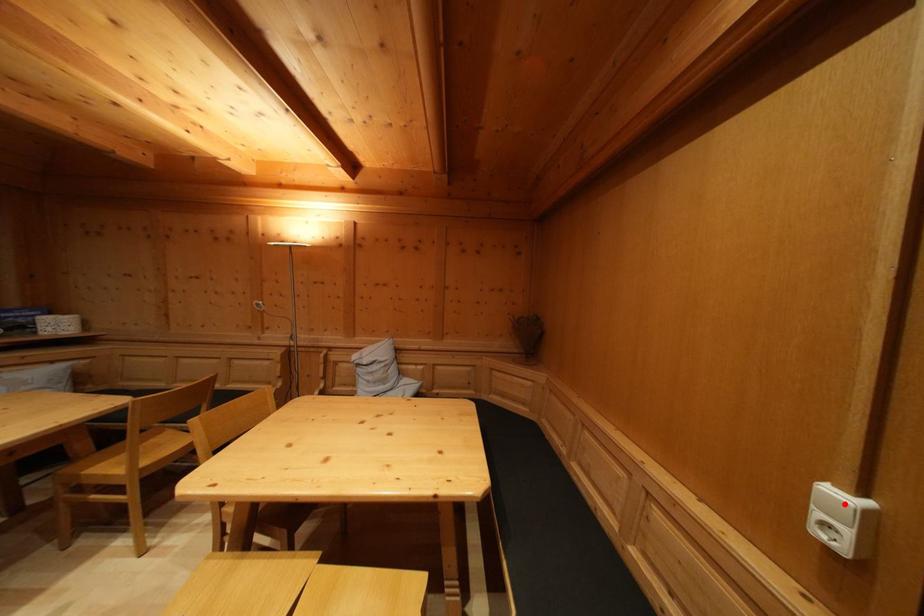
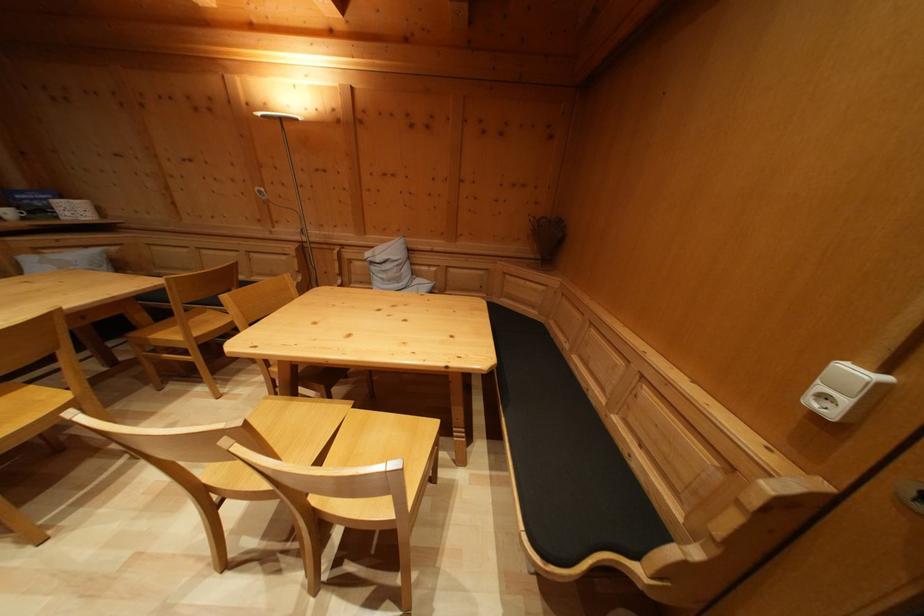
Locate, in the second image, the point that corresponds to the highlighted location in the first image.

(859, 379)